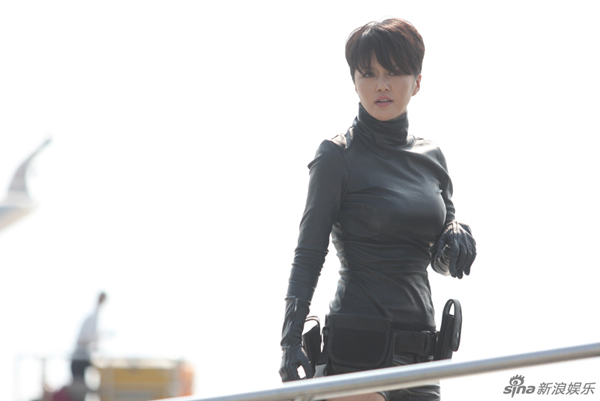
What are the coordinates of `rod` in the screenshot? It's located at (408, 372).